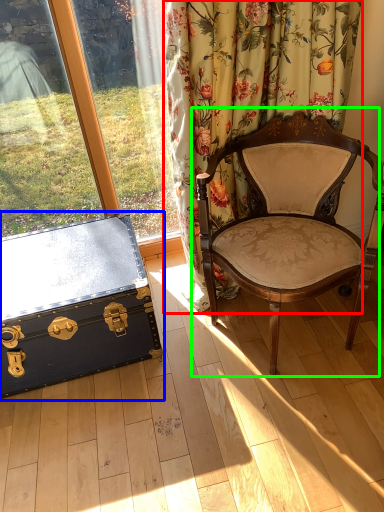
Question: Estimate the real-world distances between objects in this image. Which object is closer to curtain (highlighted by a red box), box (highlighted by a blue box) or chair (highlighted by a green box)?

Choices:
 (A) box
 (B) chair

Answer: (B)